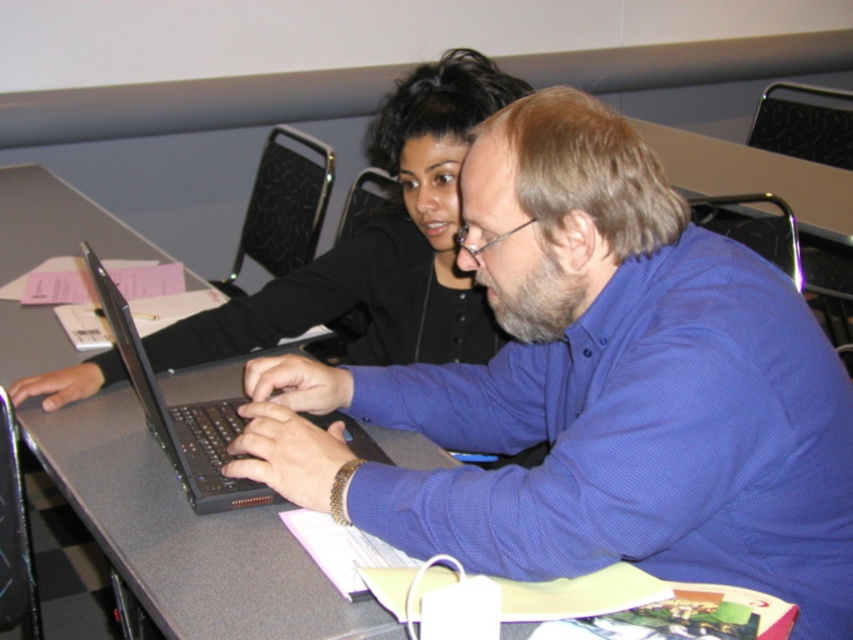
Which is in front, point (699, 480) or point (202, 406)?

Point (699, 480) is more forward.

Which is more to the right, blue matte shirt at center or black matte laptop at center?

blue matte shirt at center

Find the location of a particular element. blue matte shirt at center is located at coordinates (595, 388).

From the picture: Is the position of blue matte shirt at center more distant than that of black matte shirt at upper center?

No, it is in front of black matte shirt at upper center.

Where is `blue matte shirt at center`? Image resolution: width=853 pixels, height=640 pixels. blue matte shirt at center is located at coordinates (x=595, y=388).

Identify the location of blue matte shirt at center. (595, 388).

Does black matte shirt at upper center have a greater height compared to black matte laptop at center?

Yes.

Is point (230, 355) farther from viewer compared to point (250, 481)?

Yes, it is.

Is point (469, 292) farther from viewer compared to point (212, 406)?

Yes, it is.

Find the location of a particular element. black matte shirt at upper center is located at coordinates point(381,244).